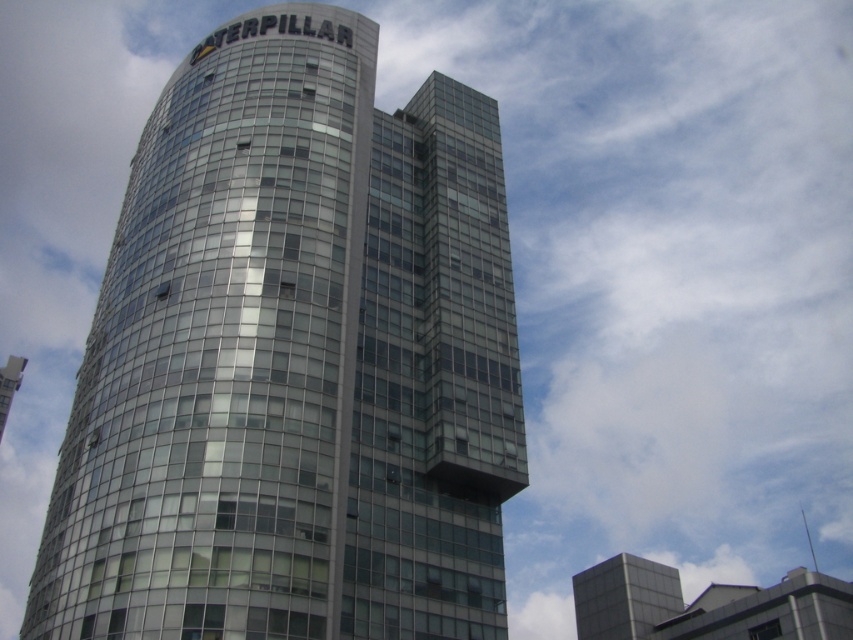
You are an architect evaluating the spatial compatibility of two buildings in a design proposal. The transparent glass building at center and the metallic glass building at upper right are part of the same complex. Based on their sizes, which building would require more floor space to accommodate its structure?

The metallic glass building at upper right requires more floor space because it is larger in size compared to the transparent glass building at center.

You are standing in front of a modern building complex and want to enter the transparent glass building at center. There is a metallic glass building at upper right nearby. Which building should you approach first based on their positions?

You should approach the transparent glass building at center first since it is closer to you than the metallic glass building at upper right.

Consider the image. You are standing at the entrance of the building and want to locate the transparent glass building at center. According to the coordinates provided, where should you look to find it?

The transparent glass building at center is located at point coordinates (294, 360).